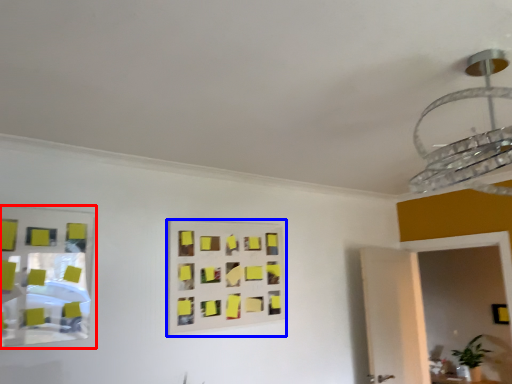
Question: Which object is further to the camera taking this photo, mirror (highlighted by a red box) or rectangle (highlighted by a blue box)?

Choices:
 (A) mirror
 (B) rectangle

Answer: (B)